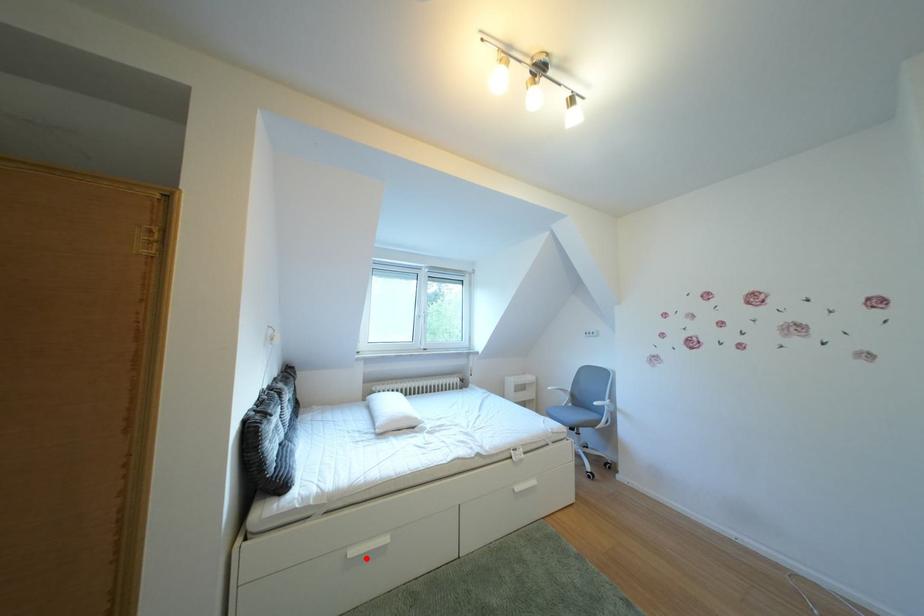
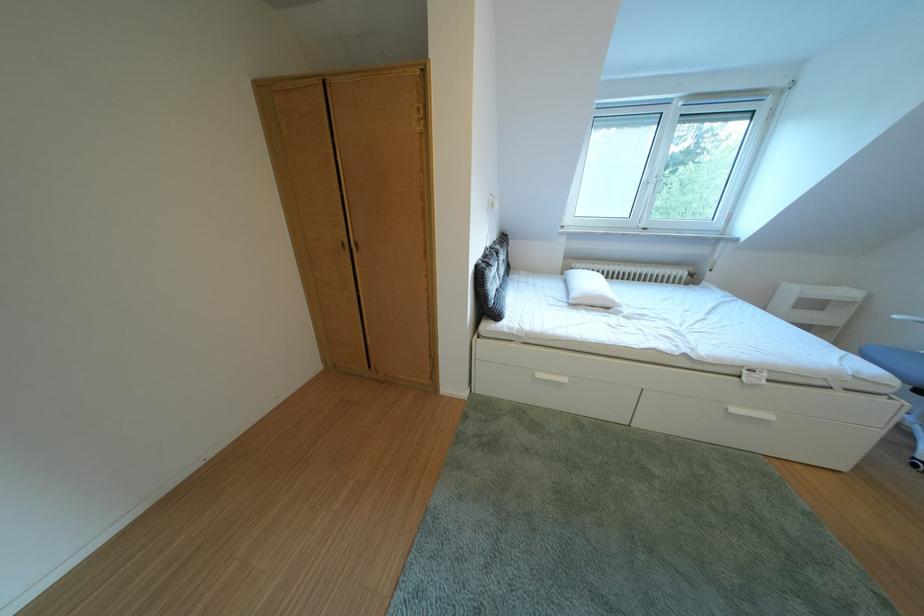
Find the pixel in the second image that matches the highlighted location in the first image.

(553, 381)